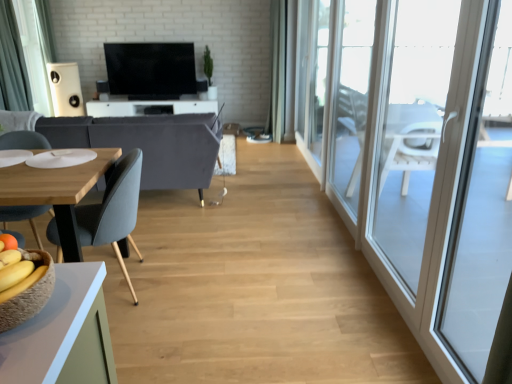
Locate an element on the screen. free space between matte gray chair at left and transparent glass screen door at right is located at coordinates (266, 305).